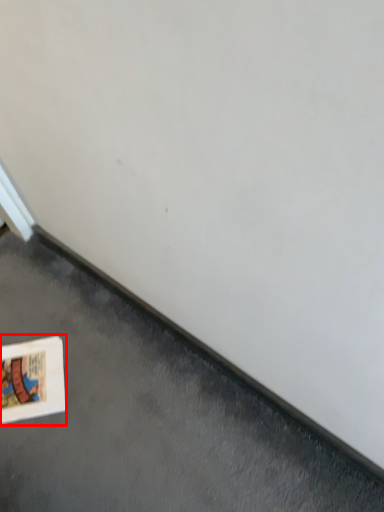
Question: In this image, where is picture frame (annotated by the red box) located relative to concrete?

Choices:
 (A) left
 (B) right

Answer: (A)